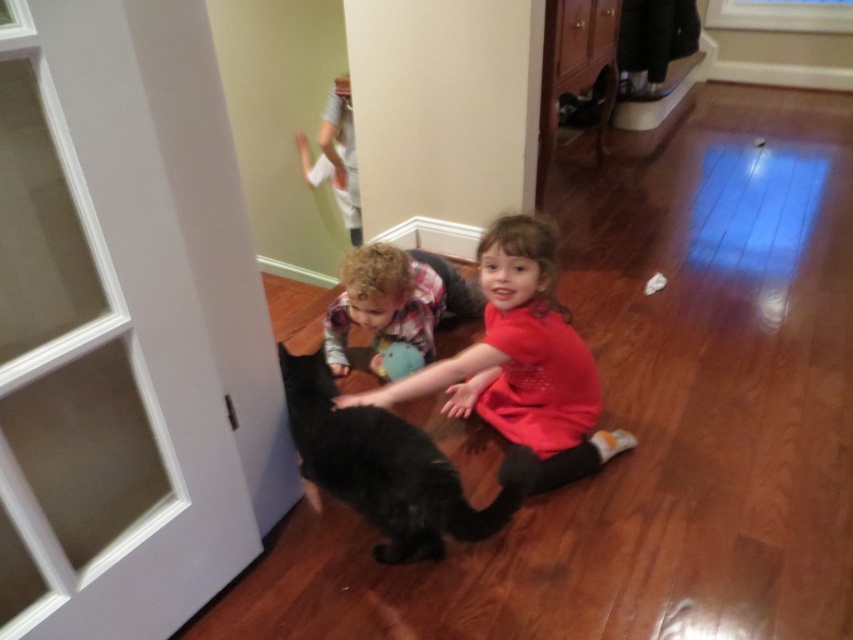
Does black fluffy cat at center have a greater height compared to fluffy brown dog at center?

Correct, black fluffy cat at center is much taller as fluffy brown dog at center.

Who is higher up, black fluffy cat at center or fluffy brown dog at center?

fluffy brown dog at center

Where is `black fluffy cat at center`? This screenshot has height=640, width=853. black fluffy cat at center is located at coordinates (384, 467).

Based on the photo, can you confirm if matte red shirt at center is shorter than black fluffy cat at center?

No.

Can you confirm if matte red shirt at center is thinner than black fluffy cat at center?

No.

At what (x,y) coordinates should I click in order to perform the action: click on matte red shirt at center. Please return your answer as a coordinate pair (x, y). This screenshot has width=853, height=640. Looking at the image, I should click on (521, 364).

Between point (64, 321) and point (404, 557), which one is positioned behind?

Positioned behind is point (404, 557).

Does transparent glass screen door at left come behind black fluffy cat at center?

No.

Measure the distance between transparent glass screen door at left and camera.

transparent glass screen door at left and camera are 87.93 centimeters apart.

Locate an element on the screen. The height and width of the screenshot is (640, 853). transparent glass screen door at left is located at coordinates (64, 372).